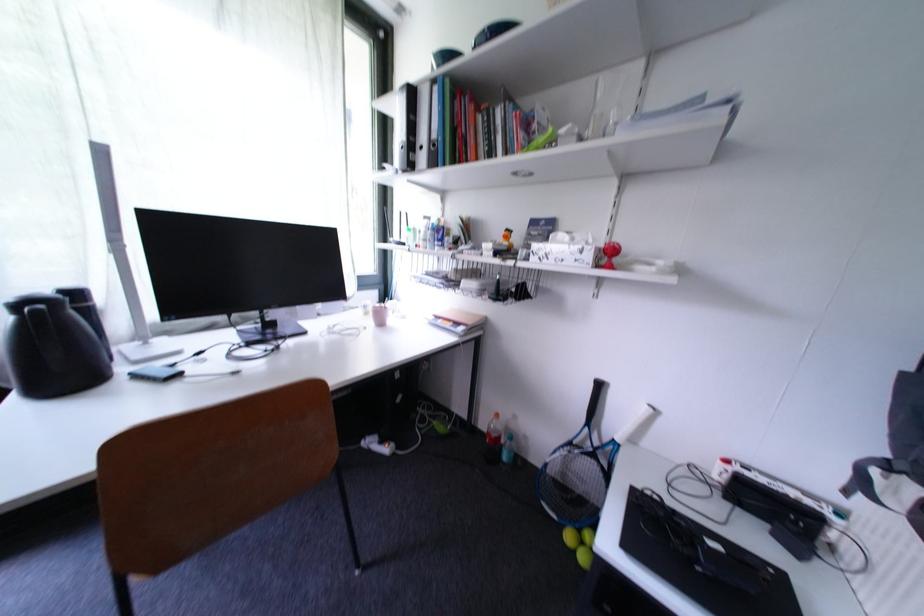
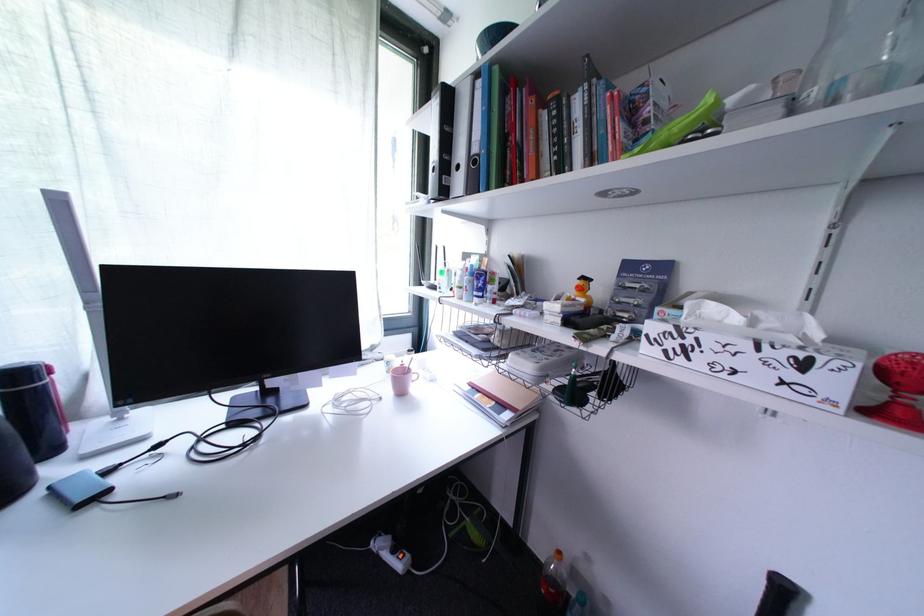
Where in the second image is the point corresponding to [575,240] from the first image?

(745, 321)